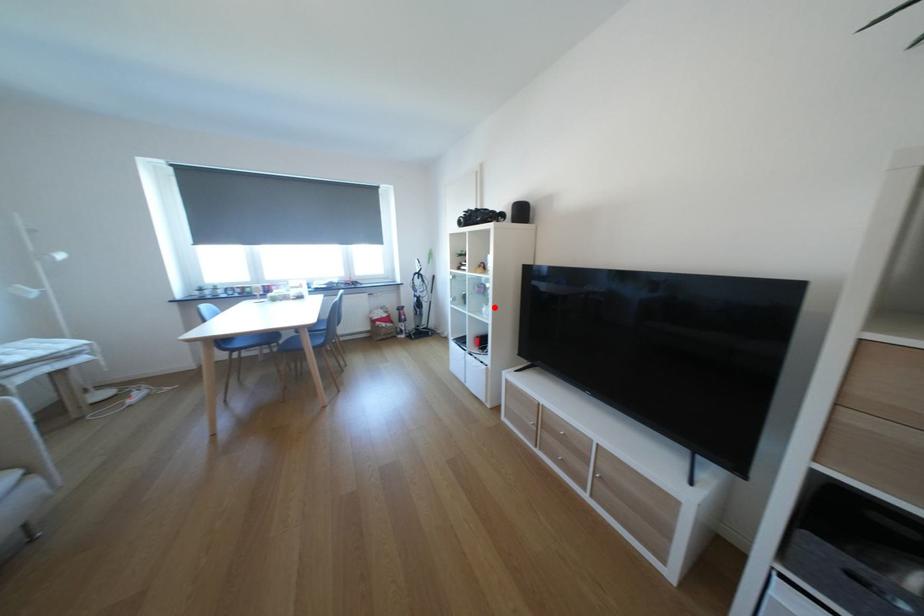
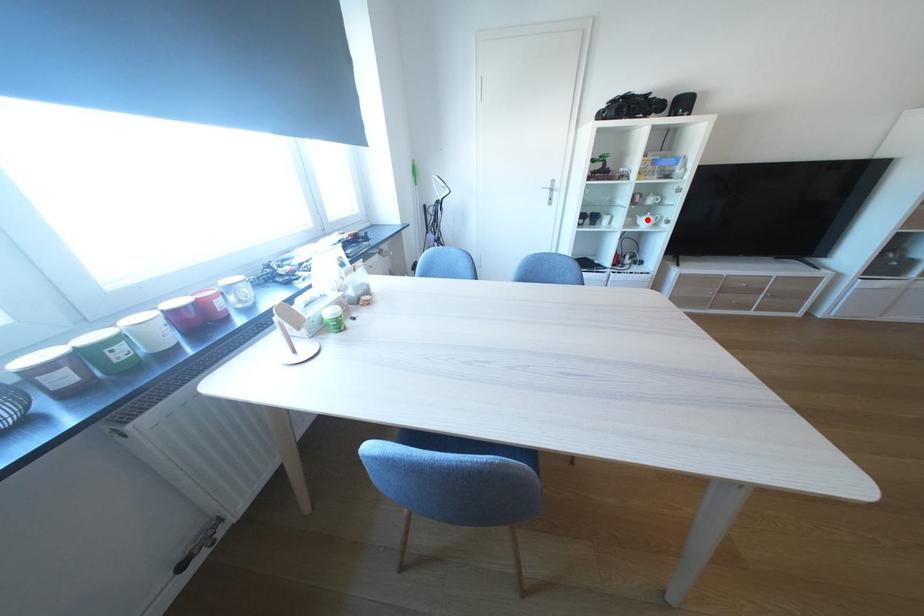
I am providing you with two images of the same scene from different viewpoints. A red point is marked on the first image and another point is marked on the second image. Does the point marked in image1 correspond to the same location as the one in image2?

Yes